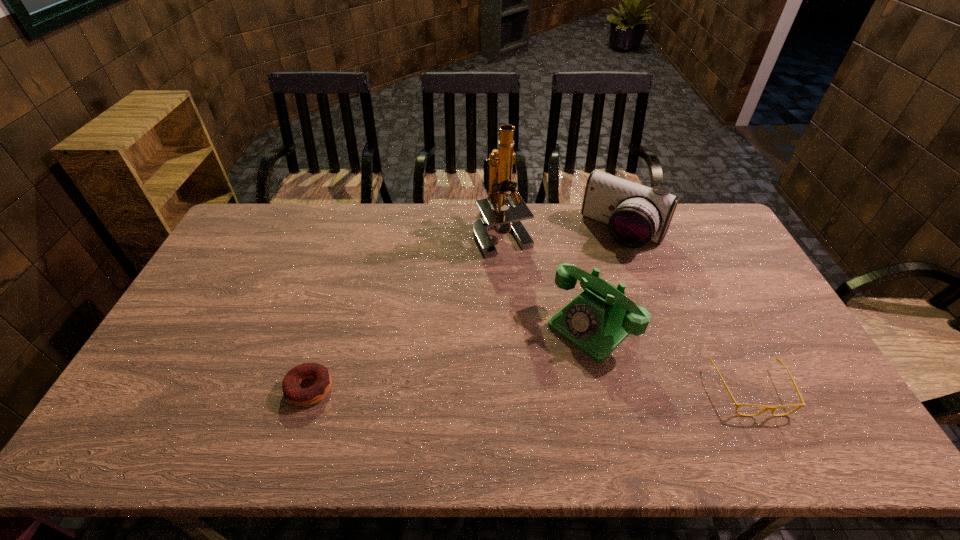
Locate an element on the screen. Image resolution: width=960 pixels, height=540 pixels. free space located 0.050m on the surface of the camcorder is located at coordinates (601, 262).

Locate an element on the screen. This screenshot has width=960, height=540. free space located 0.220m on the surface of the camcorder is located at coordinates (579, 293).

Locate an element on the screen. This screenshot has width=960, height=540. vacant space located on the surface of the camcorder is located at coordinates (575, 299).

You are a GUI agent. You are given a task and a screenshot of the screen. Output one action in this format:
    pyautogui.click(x=<x>, y=<y>)
    Task: Click on the vacant area located 0.240m on the dial of the third farthest object
    
    Given the screenshot: What is the action you would take?
    pyautogui.click(x=505, y=406)

Where is `vacant region located on the dial of the third farthest object`? The width and height of the screenshot is (960, 540). vacant region located on the dial of the third farthest object is located at coordinates (546, 368).

Where is `free space located on the dial of the third farthest object`? This screenshot has height=540, width=960. free space located on the dial of the third farthest object is located at coordinates coord(534,379).

What are the coordinates of `microscope located in the far edge section of the desktop` in the screenshot? It's located at (498, 167).

You are a GUI agent. You are given a task and a screenshot of the screen. Output one action in this format:
    pyautogui.click(x=<x>, y=<y>)
    Task: Click on the camcorder that is at the far edge
    
    Given the screenshot: What is the action you would take?
    pyautogui.click(x=635, y=214)

The image size is (960, 540). Find the location of `doughnut that is at the near edge`. doughnut that is at the near edge is located at coordinates (293, 393).

Where is `spectacles present at the near edge`? spectacles present at the near edge is located at coordinates (772, 408).